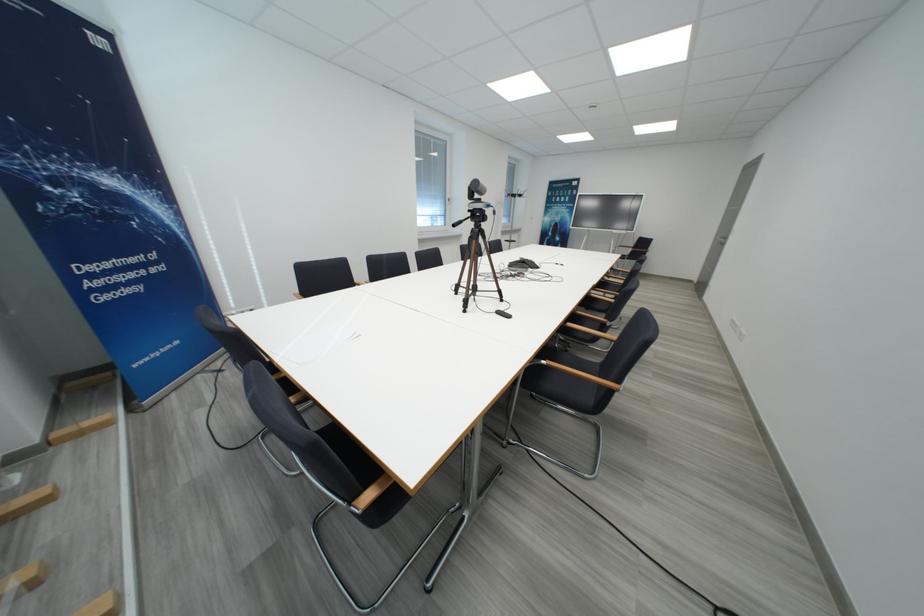
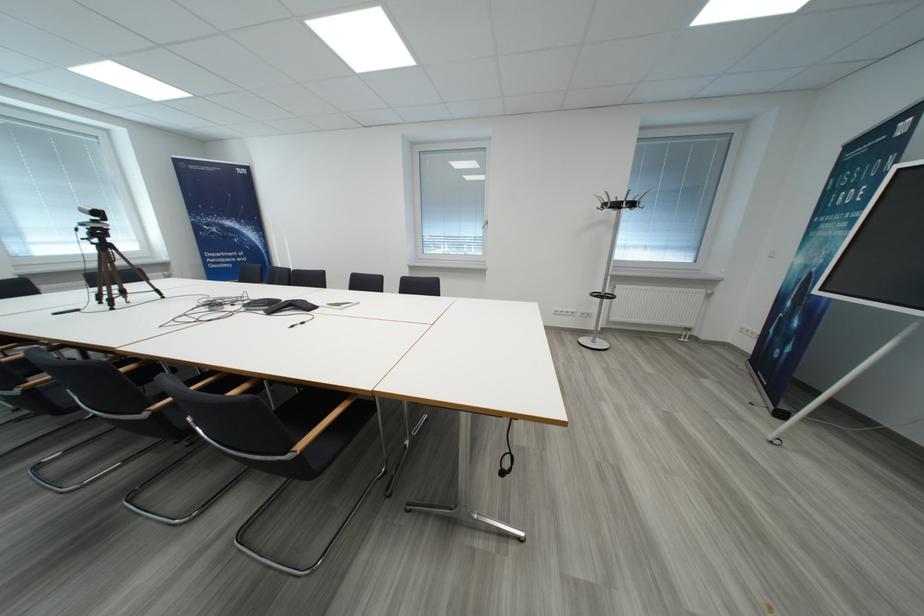
In the second image, find the point that corresponds to [527,199] in the first image.

(623, 208)